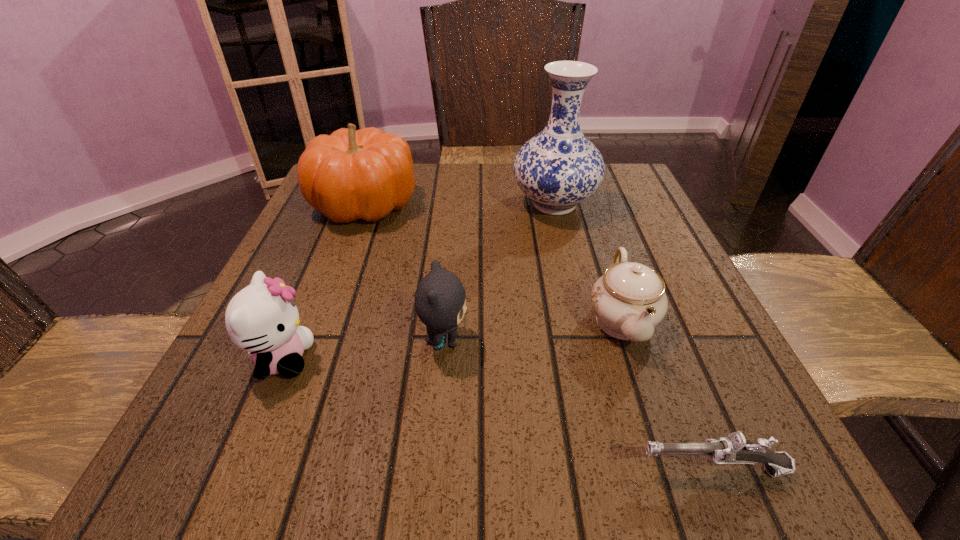
The width and height of the screenshot is (960, 540). Find the location of `the tallest object`. the tallest object is located at coordinates (557, 169).

You are a GUI agent. You are given a task and a screenshot of the screen. Output one action in this format:
    pyautogui.click(x=<x>, y=<y>)
    Task: Click on the pumpkin
    Image resolution: width=960 pixels, height=540 pixels.
    Given the screenshot: What is the action you would take?
    pyautogui.click(x=351, y=174)

Image resolution: width=960 pixels, height=540 pixels. I want to click on the left kitten, so click(x=262, y=318).

Image resolution: width=960 pixels, height=540 pixels. Identify the location of the right kitten. (440, 300).

The width and height of the screenshot is (960, 540). In order to click on chinaware in this screenshot , I will do `click(629, 300)`.

In order to click on gun in this screenshot , I will do `click(734, 449)`.

Locate an element on the screen. This screenshot has width=960, height=540. the nearest object is located at coordinates (734, 449).

The width and height of the screenshot is (960, 540). In order to click on free space located on the left of the tallest object in this screenshot , I will do `click(443, 204)`.

Locate an element on the screen. vacant space located 0.090m on the right of the pumpkin is located at coordinates tap(457, 203).

Find the location of a particular element. free space located 0.210m on the front-facing side of the left kitten is located at coordinates (447, 359).